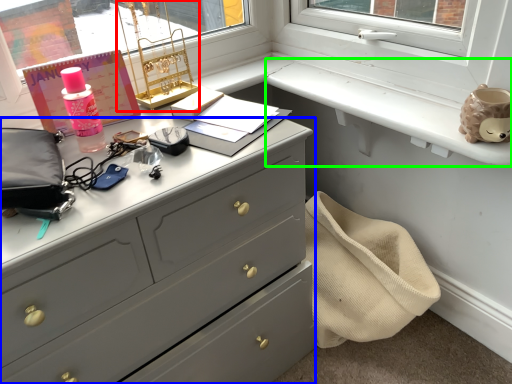
Question: Estimate the real-world distances between objects in this image. Which object is closer to table lamp (highlighted by a red box), chest of drawers (highlighted by a blue box) or window sill (highlighted by a green box)?

Choices:
 (A) chest of drawers
 (B) window sill

Answer: (B)